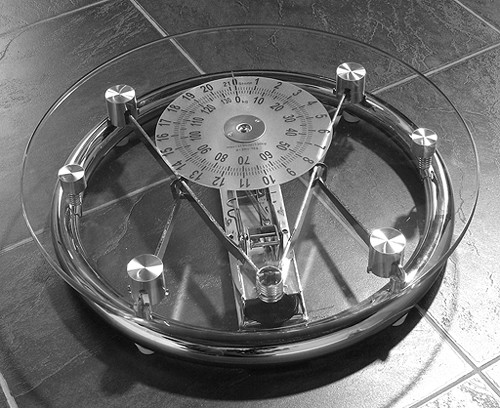
Where is `bar supports`? bar supports is located at coordinates (301, 213), (213, 219), (160, 151), (341, 105).